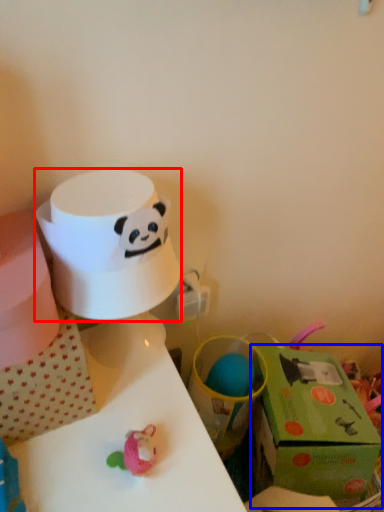
Question: Among these objects, which one is farthest to the camera, paper towel (highlighted by a red box) or gift box (highlighted by a blue box)?

Choices:
 (A) paper towel
 (B) gift box

Answer: (B)